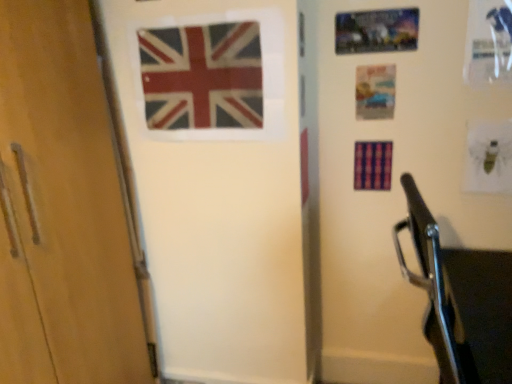
Question: Is matte paper postcard at upper right, acting as the 2th postcard starting from the top, to the right of matte plastic flag at center, the 2th flag in the right-to-left sequence, from the viewer's perspective?

Choices:
 (A) yes
 (B) no

Answer: (A)

Question: Does matte paper postcard at upper right, which is the 1th postcard from bottom to top, have a smaller size compared to matte plastic flag at center, the 2th flag in the right-to-left sequence?

Choices:
 (A) no
 (B) yes

Answer: (B)

Question: Considering the relative sizes of matte paper postcard at upper right, acting as the 2th postcard starting from the top, and matte plastic flag at center, the 2th flag in the right-to-left sequence, in the image provided, is matte paper postcard at upper right, acting as the 2th postcard starting from the top, wider than matte plastic flag at center, the 2th flag in the right-to-left sequence,?

Choices:
 (A) no
 (B) yes

Answer: (A)

Question: Is matte paper postcard at upper right, which is the 1th postcard from bottom to top, further to camera compared to matte plastic flag at center, the 2th flag in the right-to-left sequence?

Choices:
 (A) yes
 (B) no

Answer: (A)

Question: Does matte paper postcard at upper right, acting as the 2th postcard starting from the top, appear on the left side of matte plastic flag at center, the second flag in the left-to-right sequence?

Choices:
 (A) yes
 (B) no

Answer: (B)

Question: Is plaid fabric flag at center, which is the first flag in right-to-left order, facing away from matte fabric flag at upper center, the third flag viewed from the right?

Choices:
 (A) yes
 (B) no

Answer: (B)

Question: Is the position of plaid fabric flag at center, which is the first flag in right-to-left order, more distant than that of matte fabric flag at upper center, the first flag from the left?

Choices:
 (A) yes
 (B) no

Answer: (A)

Question: Can you confirm if plaid fabric flag at center, the third flag viewed from the left, is smaller than matte fabric flag at upper center, the third flag viewed from the right?

Choices:
 (A) no
 (B) yes

Answer: (B)

Question: Is there a large distance between plaid fabric flag at center, the third flag viewed from the left, and matte fabric flag at upper center, the third flag viewed from the right?

Choices:
 (A) no
 (B) yes

Answer: (A)

Question: From the image's perspective, does plaid fabric flag at center, the third flag viewed from the left, appear higher than matte fabric flag at upper center, the first flag from the left?

Choices:
 (A) yes
 (B) no

Answer: (B)

Question: Can you confirm if plaid fabric flag at center, the third flag viewed from the left, is positioned to the right of matte fabric flag at upper center, the first flag from the left?

Choices:
 (A) yes
 (B) no

Answer: (A)

Question: From a real-world perspective, is matte paper postcard at upper right, acting as the 2th postcard starting from the top, beneath metallic silver postcard at upper right, arranged as the 1th postcard when viewed from the top?

Choices:
 (A) no
 (B) yes

Answer: (B)